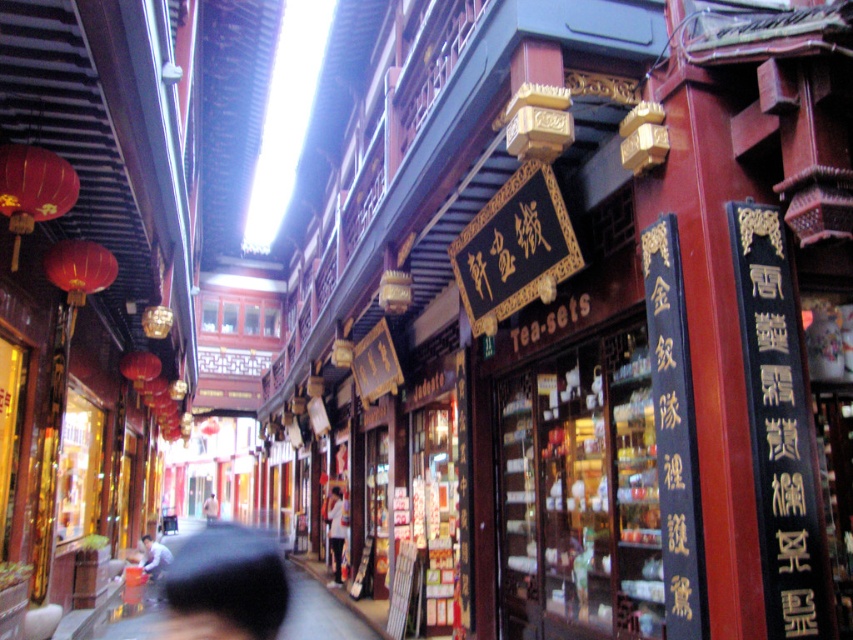
Question: In this image, where is black wood sign at right located relative to white cotton shirt at center?

Choices:
 (A) right
 (B) left

Answer: (A)

Question: Can you confirm if white matte shirt at center is smaller than white cotton shirt at center?

Choices:
 (A) yes
 (B) no

Answer: (B)

Question: Considering the real-world distances, which object is closest to the white matte shirt at center?

Choices:
 (A) dark gray fabric umbrella at lower center
 (B) white cotton shirt at center

Answer: (A)

Question: Which point appears closest to the camera in this image?

Choices:
 (A) (770, 285)
 (B) (209, 513)
 (C) (231, 552)
 (D) (341, 518)

Answer: (A)

Question: Does dark gray fabric umbrella at lower center have a greater width compared to white matte shirt at center?

Choices:
 (A) no
 (B) yes

Answer: (B)

Question: Which point is farther to the camera?

Choices:
 (A) dark gray fabric umbrella at lower center
 (B) white cotton shirt at center
 (C) black wood sign at right

Answer: (B)